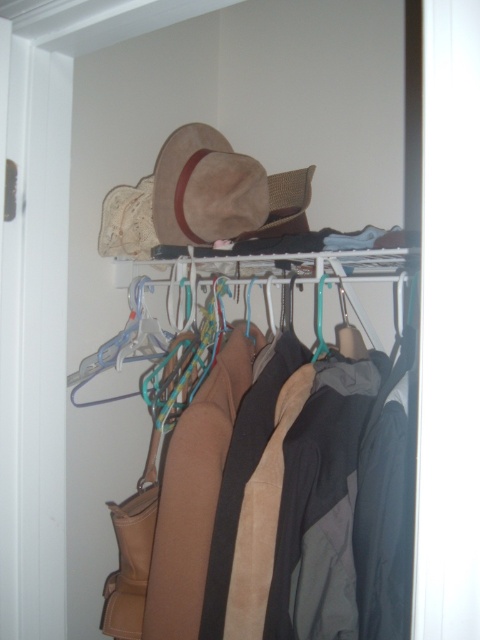
You are trying to place a camera on the shelf where the suede brown cowboy hat at upper center is located. The camera requires 1.5 meters of space. Is there enough space on the shelf?

The suede brown cowboy hat at upper center and camera are 1.38 meters apart from each other, so there is not enough space to place the camera on the shelf since it requires 1.5 meters.

You are organizing the closet and want to place a new scarf between the suede brown cowboy hat at upper center and the suede coat at center. Is there enough vertical space to do this?

The suede brown cowboy hat at upper center is above the suede coat at center, so there is vertical space between them. You can place the scarf there.

You are organizing the closet and need to place a new accessory between the suede brown cowboy hat at upper center and the suede coat at center. According to their current positions, which side should you place the accessory on to keep it between them?

The suede brown cowboy hat at upper center is positioned on the left side of the suede coat at center, so placing the accessory to the right of the hat and to the left of the coat will keep it between them.